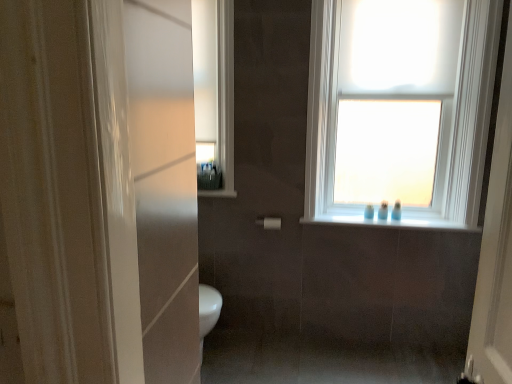
I want to click on free point above white glossy window sill at upper center, acting as the second window sill starting from the right (from a real-world perspective), so click(216, 188).